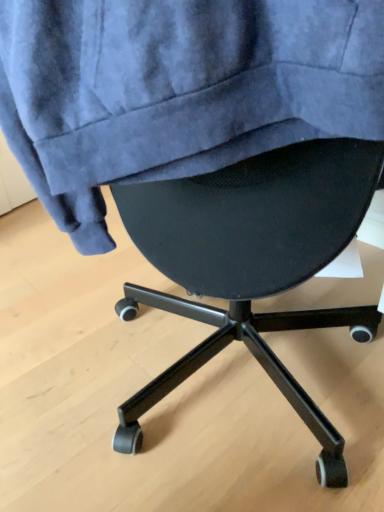
The image size is (384, 512). Describe the element at coordinates (176, 90) in the screenshot. I see `velvet blue sweatshirt at upper center` at that location.

You are a GUI agent. You are given a task and a screenshot of the screen. Output one action in this format:
    pyautogui.click(x=<x>, y=<y>)
    Task: Click on the velvet blue sweatshirt at upper center
    Image resolution: width=384 pixels, height=512 pixels.
    Given the screenshot: What is the action you would take?
    pyautogui.click(x=176, y=90)

Where is `black mesh chair at center`? black mesh chair at center is located at coordinates (251, 263).

This screenshot has width=384, height=512. What do you see at coordinates (251, 263) in the screenshot? I see `black mesh chair at center` at bounding box center [251, 263].

You are a GUI agent. You are given a task and a screenshot of the screen. Output one action in this format:
    pyautogui.click(x=<x>, y=<y>)
    Task: Click on the velvet blue sweatshirt at upper center
    
    Given the screenshot: What is the action you would take?
    pyautogui.click(x=176, y=90)

Can you confirm if black mesh chair at center is positioned to the right of velvet blue sweatshirt at upper center?

No.

Is black mesh chair at center positioned before velvet blue sweatshirt at upper center?

No, black mesh chair at center is further to the viewer.

Considering the points (345, 229) and (168, 115), which point is in front, point (345, 229) or point (168, 115)?

The point (168, 115) is closer to the camera.

Looking at this image, from the image's perspective, would you say black mesh chair at center is shown under velvet blue sweatshirt at upper center?

Yes.

From a real-world perspective, does black mesh chair at center sit lower than velvet blue sweatshirt at upper center?

Correct, in the physical world, black mesh chair at center is lower than velvet blue sweatshirt at upper center.

Is black mesh chair at center thinner than velvet blue sweatshirt at upper center?

Incorrect, the width of black mesh chair at center is not less than that of velvet blue sweatshirt at upper center.

Can you confirm if black mesh chair at center is shorter than velvet blue sweatshirt at upper center?

Yes, black mesh chair at center is shorter than velvet blue sweatshirt at upper center.

Does black mesh chair at center have a larger size compared to velvet blue sweatshirt at upper center?

No.

Would you say black mesh chair at center contains velvet blue sweatshirt at upper center?

Definitely not — velvet blue sweatshirt at upper center is not inside black mesh chair at center.

Is black mesh chair at center not near velvet blue sweatshirt at upper center?

black mesh chair at center is near velvet blue sweatshirt at upper center, not far away.

Is black mesh chair at center facing away from velvet blue sweatshirt at upper center?

No, black mesh chair at center is not facing the opposite direction of velvet blue sweatshirt at upper center.

Locate an element on the screen. sweatshirt in front of the black mesh chair at center is located at coordinates (176, 90).

Can you confirm if velvet blue sweatshirt at upper center is positioned to the right of black mesh chair at center?

Yes, velvet blue sweatshirt at upper center is to the right of black mesh chair at center.

Considering their positions, is velvet blue sweatshirt at upper center located in front of or behind black mesh chair at center?

Clearly, velvet blue sweatshirt at upper center is in front of black mesh chair at center.

Is point (43, 54) positioned behind point (202, 345)?

No, it is not.

From the image's perspective, does velvet blue sweatshirt at upper center appear higher than black mesh chair at center?

Yes, from the image's perspective, velvet blue sweatshirt at upper center is on top of black mesh chair at center.

From a real-world perspective, which is physically below, velvet blue sweatshirt at upper center or black mesh chair at center?

black mesh chair at center, from a real-world perspective.

Considering the relative sizes of velvet blue sweatshirt at upper center and black mesh chair at center in the image provided, is velvet blue sweatshirt at upper center wider than black mesh chair at center?

No, velvet blue sweatshirt at upper center is not wider than black mesh chair at center.

Considering the sizes of objects velvet blue sweatshirt at upper center and black mesh chair at center in the image provided, who is taller, velvet blue sweatshirt at upper center or black mesh chair at center?

Standing taller between the two is velvet blue sweatshirt at upper center.

Does velvet blue sweatshirt at upper center have a smaller size compared to black mesh chair at center?

No.

Based on the photo, is velvet blue sweatshirt at upper center positioned beyond the bounds of black mesh chair at center?

Yes.

Consider the image. Is velvet blue sweatshirt at upper center placed right next to black mesh chair at center?

velvet blue sweatshirt at upper center is not next to black mesh chair at center, and they're not touching.

Is velvet blue sweatshirt at upper center facing away from black mesh chair at center?

No, velvet blue sweatshirt at upper center's orientation is not away from black mesh chair at center.

Image resolution: width=384 pixels, height=512 pixels. In order to click on sweatshirt in front of the black mesh chair at center in this screenshot , I will do `click(176, 90)`.

Identify the location of sweatshirt above the black mesh chair at center (from a real-world perspective). (176, 90).

Image resolution: width=384 pixels, height=512 pixels. Find the location of `sweatshirt above the black mesh chair at center (from the image's perspective)`. sweatshirt above the black mesh chair at center (from the image's perspective) is located at coordinates (176, 90).